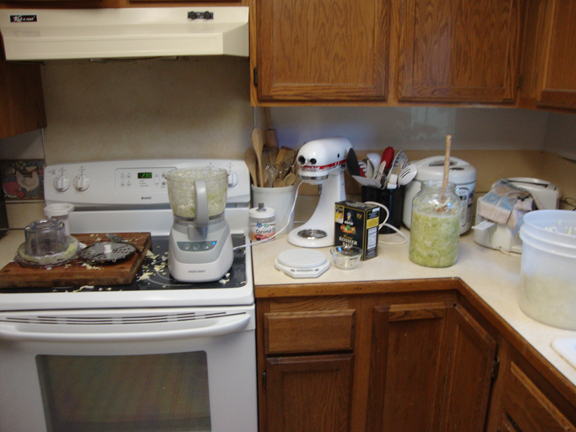
This screenshot has height=432, width=576. What are the coordinates of `countertop` in the screenshot? It's located at (491, 273).